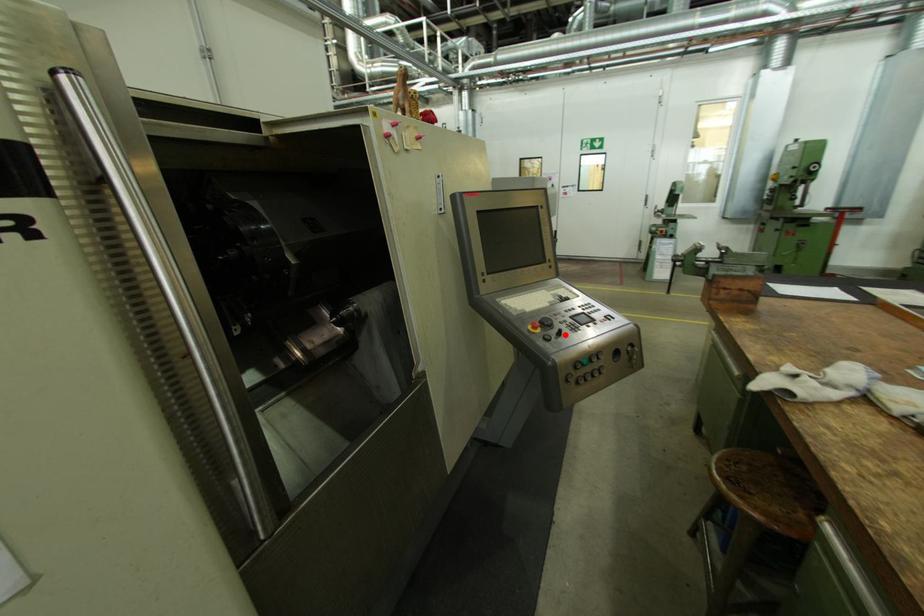
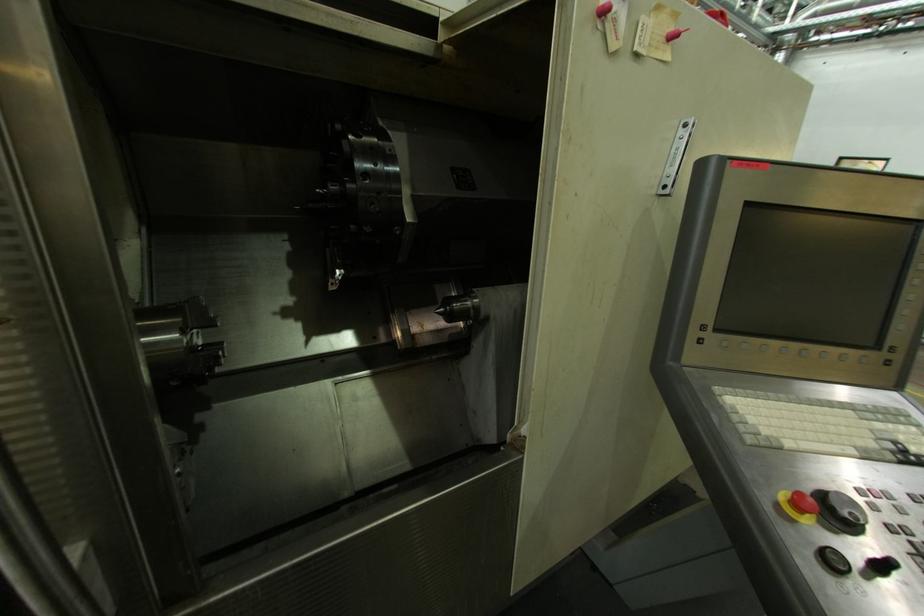
Question: I am providing you with two images of the same scene from different viewpoints. Image1 has a red point marked. In image2, the corresponding 3D location appears at what relative position? Reply with the corresponding letter.

Choices:
 (A) Closer
 (B) Farther

Answer: (A)